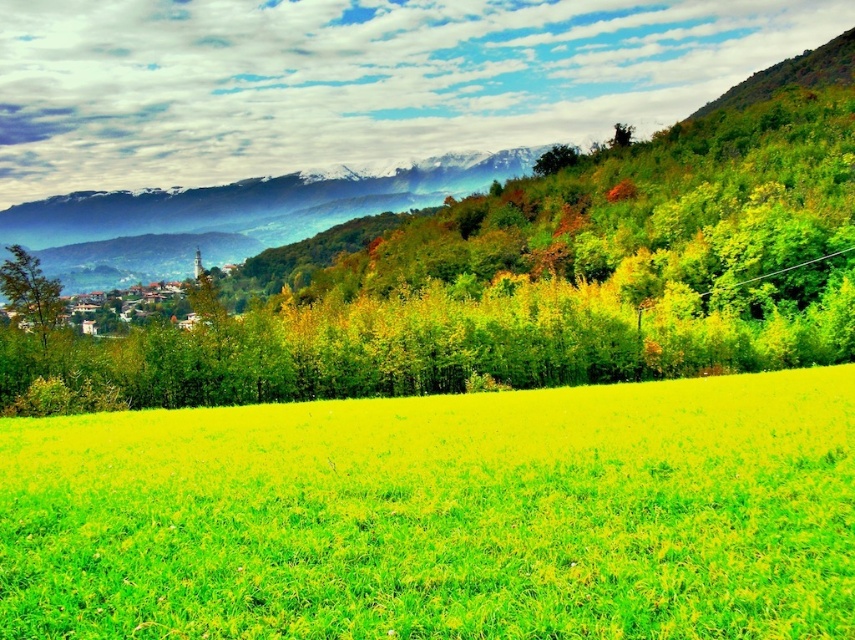
You are standing in the landscape scene and want to take a photo of the bright green grass at center and the green matte tree at left. Which object should you focus on first if you want to capture both in focus without adjusting your camera settings?

The bright green grass at center is located below the green matte tree at left, so you should focus on the green matte tree at left first since it is farther away to ensure both are in focus.

You are standing in the field and want to walk towards the village. Which direction should you go relative to the bright green grass at center and the green matte tree at left?

Since the bright green grass at center is to the right of the green matte tree at left, you should walk towards the left direction of the green matte tree at left to head toward the village.